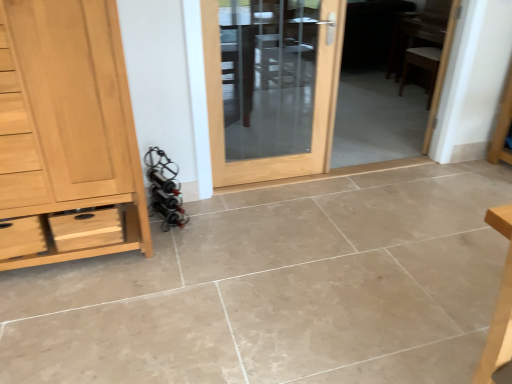
Question: From the image's perspective, is light brown wood chest of drawers at left on matte wooden door at center?

Choices:
 (A) yes
 (B) no

Answer: (B)

Question: Considering the relative sizes of light brown wood chest of drawers at left and matte wooden door at center in the image provided, is light brown wood chest of drawers at left shorter than matte wooden door at center?

Choices:
 (A) no
 (B) yes

Answer: (A)

Question: From the image's perspective, is light brown wood chest of drawers at left under matte wooden door at center?

Choices:
 (A) no
 (B) yes

Answer: (B)

Question: Is matte wooden door at center located within light brown wood chest of drawers at left?

Choices:
 (A) yes
 (B) no

Answer: (B)

Question: Can you confirm if light brown wood chest of drawers at left is wider than matte wooden door at center?

Choices:
 (A) yes
 (B) no

Answer: (A)

Question: From the image's perspective, is wooden chair at right, acting as the 2th chair starting from the bottom, located above or below matte wooden door at center?

Choices:
 (A) above
 (B) below

Answer: (A)

Question: Is wooden chair at right, which is the first chair in top-to-bottom order, spatially inside matte wooden door at center, or outside of it?

Choices:
 (A) inside
 (B) outside

Answer: (B)

Question: From their relative heights in the image, would you say wooden chair at right, which is the first chair in top-to-bottom order, is taller or shorter than matte wooden door at center?

Choices:
 (A) short
 (B) tall

Answer: (A)

Question: Would you say wooden chair at right, acting as the 2th chair starting from the bottom, is to the left or to the right of matte wooden door at center in the picture?

Choices:
 (A) right
 (B) left

Answer: (A)

Question: Visually, is matte wooden door at center positioned to the left or to the right of light brown wood chest of drawers at left?

Choices:
 (A) left
 (B) right

Answer: (B)

Question: Considering their positions, is matte wooden door at center located in front of or behind light brown wood chest of drawers at left?

Choices:
 (A) behind
 (B) front

Answer: (A)

Question: From the image's perspective, is matte wooden door at center above or below light brown wood chest of drawers at left?

Choices:
 (A) above
 (B) below

Answer: (A)

Question: From a real-world perspective, is matte wooden door at center positioned above or below light brown wood chest of drawers at left?

Choices:
 (A) above
 (B) below

Answer: (B)

Question: In the image, is light brown wood chest of drawers at left positioned in front of or behind matte wooden door at center?

Choices:
 (A) front
 (B) behind

Answer: (A)

Question: Does point (112, 64) appear closer or farther from the camera than point (321, 9)?

Choices:
 (A) farther
 (B) closer

Answer: (B)